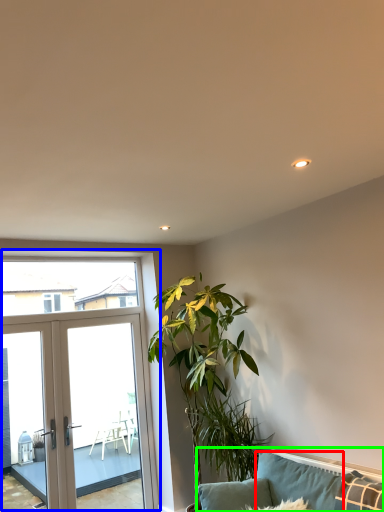
Question: Which object is positioned closest to pillow (highlighted by a red box)? Select from window (highlighted by a blue box) and studio couch (highlighted by a green box).

Choices:
 (A) window
 (B) studio couch

Answer: (B)